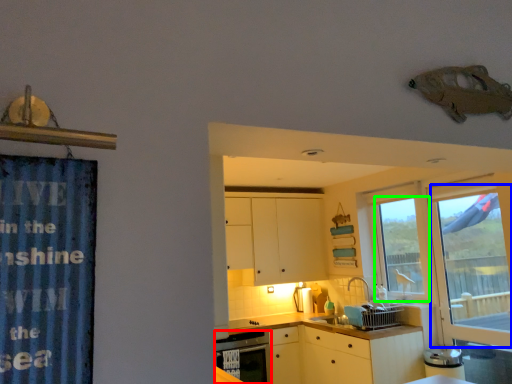
Question: Estimate the real-world distances between objects in this image. Which object is farther from dish washer (highlighted by a red box), glass door (highlighted by a blue box) or window (highlighted by a green box)?

Choices:
 (A) glass door
 (B) window

Answer: (A)